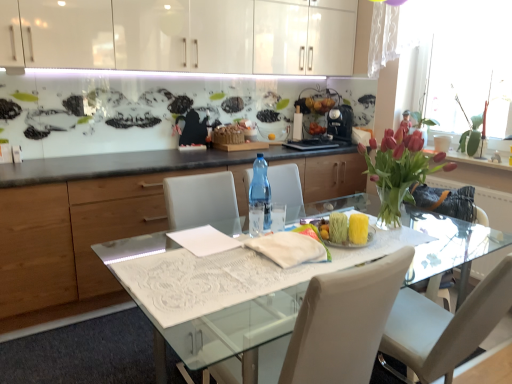
Question: Is translucent glass vase at upper right not near white fabric at center?

Choices:
 (A) no
 (B) yes

Answer: (B)

Question: Is translucent glass vase at upper right facing towards white fabric at center?

Choices:
 (A) no
 (B) yes

Answer: (B)

Question: Is translucent glass vase at upper right outside of white fabric at center?

Choices:
 (A) yes
 (B) no

Answer: (A)

Question: Does translucent glass vase at upper right come behind white fabric at center?

Choices:
 (A) yes
 (B) no

Answer: (A)

Question: From the image's perspective, is translucent glass vase at upper right beneath white fabric at center?

Choices:
 (A) no
 (B) yes

Answer: (A)

Question: From the image's perspective, is transparent glass table at center positioned above or below translucent glass vase at upper right?

Choices:
 (A) below
 (B) above

Answer: (A)

Question: Based on their positions, is transparent glass table at center located to the left or right of translucent glass vase at upper right?

Choices:
 (A) right
 (B) left

Answer: (B)

Question: Is transparent glass table at center taller or shorter than translucent glass vase at upper right?

Choices:
 (A) tall
 (B) short

Answer: (B)

Question: From a real-world perspective, is transparent glass table at center above or below translucent glass vase at upper right?

Choices:
 (A) below
 (B) above

Answer: (A)

Question: In the image, is transparent glass table at center positioned in front of or behind transparent plastic bottle at center?

Choices:
 (A) front
 (B) behind

Answer: (A)

Question: Is transparent glass table at center to the left or to the right of transparent plastic bottle at center in the image?

Choices:
 (A) left
 (B) right

Answer: (B)

Question: Is transparent glass table at center taller or shorter than transparent plastic bottle at center?

Choices:
 (A) short
 (B) tall

Answer: (B)

Question: Considering the positions of point (298, 213) and point (254, 183), is point (298, 213) closer or farther from the camera than point (254, 183)?

Choices:
 (A) closer
 (B) farther

Answer: (B)

Question: Is pink glass vase at right to the left or to the right of white leather chair at center in the image?

Choices:
 (A) left
 (B) right

Answer: (B)

Question: Based on their sizes in the image, would you say pink glass vase at right is bigger or smaller than white leather chair at center?

Choices:
 (A) big
 (B) small

Answer: (B)